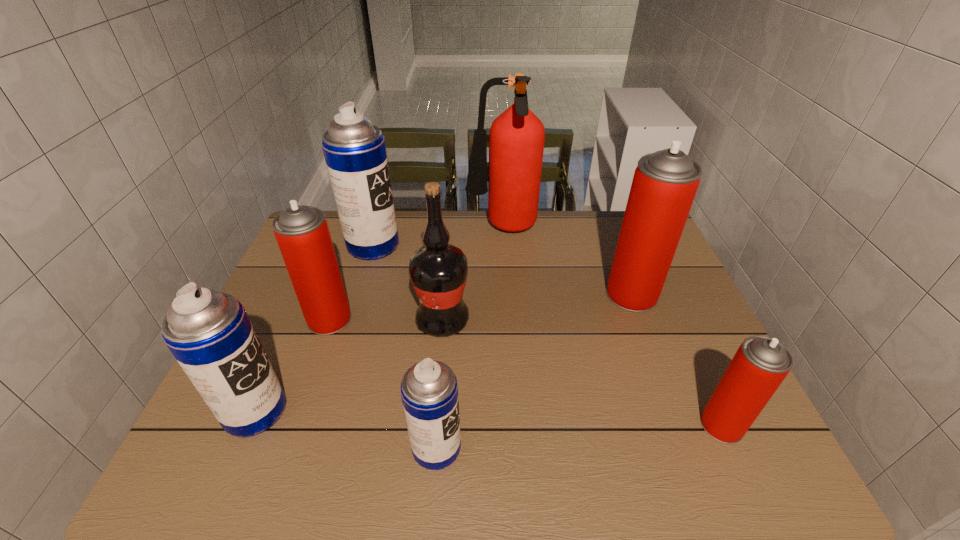
You are a GUI agent. You are given a task and a screenshot of the screen. Output one action in this format:
    pyautogui.click(x=<x>, y=<y>)
    Task: Click on the free space at the near right corner
    The height and width of the screenshot is (540, 960).
    Given the screenshot: What is the action you would take?
    pyautogui.click(x=717, y=479)

Locate an element on the screen. free spot between the red fire extinguisher and the smallest blue aerosol can is located at coordinates (469, 339).

Find the location of `empty location between the nearest red aerosol can and the biggest blue aerosol can`. empty location between the nearest red aerosol can and the biggest blue aerosol can is located at coordinates (547, 335).

The image size is (960, 540). Find the location of `unoccupied position between the leftmost red aerosol can and the smallest red aerosol can`. unoccupied position between the leftmost red aerosol can and the smallest red aerosol can is located at coordinates (525, 372).

The width and height of the screenshot is (960, 540). What are the coordinates of `free area in between the biggest red aerosol can and the third aerosol can from right to left` in the screenshot? It's located at (534, 371).

Locate an element on the screen. This screenshot has width=960, height=540. vacant region between the fire extinguisher and the rightmost blue aerosol can is located at coordinates (469, 339).

Image resolution: width=960 pixels, height=540 pixels. Find the location of `unoccupied area between the farthest aerosol can and the second biggest red aerosol can`. unoccupied area between the farthest aerosol can and the second biggest red aerosol can is located at coordinates (351, 282).

Find the location of a particular element. The height and width of the screenshot is (540, 960). free point between the biggest red aerosol can and the leftmost red aerosol can is located at coordinates (481, 307).

The width and height of the screenshot is (960, 540). I want to click on free point between the biggest red aerosol can and the fire extinguisher, so click(x=566, y=262).

Image resolution: width=960 pixels, height=540 pixels. I want to click on empty location between the biggest red aerosol can and the red wine bottle, so click(x=538, y=307).